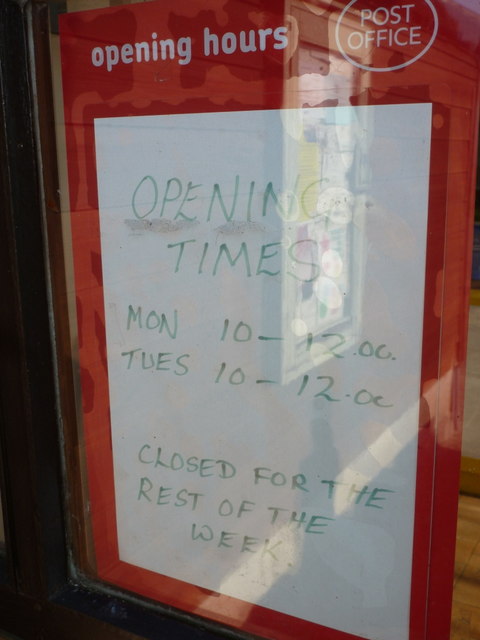
Where is `frame`? frame is located at coordinates (458, 139).